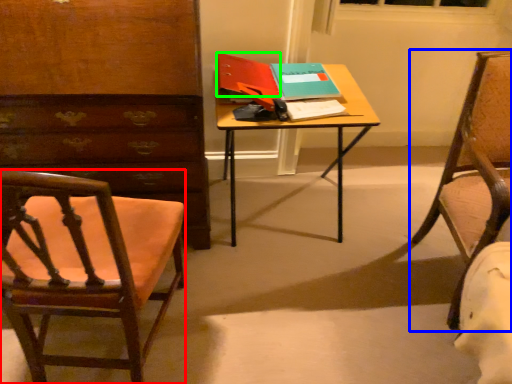
Question: Estimate the real-world distances between objects in this image. Which object is closer to chair (highlighted by a red box), chair (highlighted by a blue box) or book (highlighted by a green box)?

Choices:
 (A) chair
 (B) book

Answer: (B)